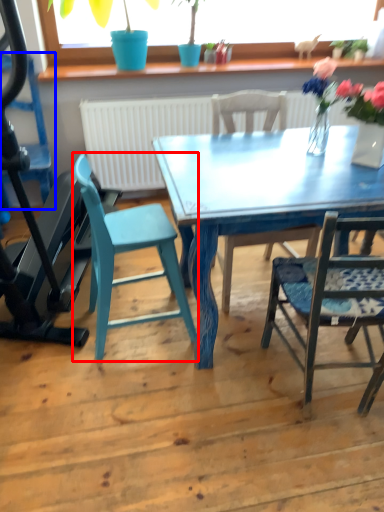
Question: Among these objects, which one is nearest to the camera, chair (highlighted by a red box) or chair (highlighted by a blue box)?

Choices:
 (A) chair
 (B) chair

Answer: (A)